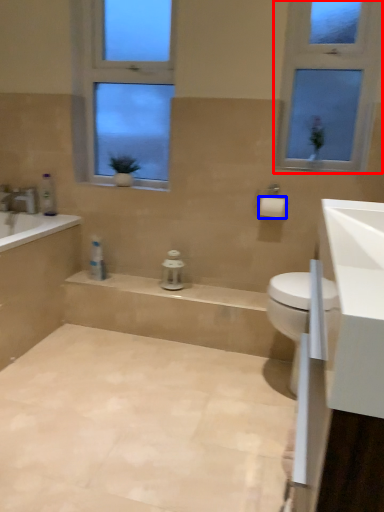
Question: Which object is closer to the camera taking this photo, window (highlighted by a red box) or toilet paper (highlighted by a blue box)?

Choices:
 (A) window
 (B) toilet paper

Answer: (A)